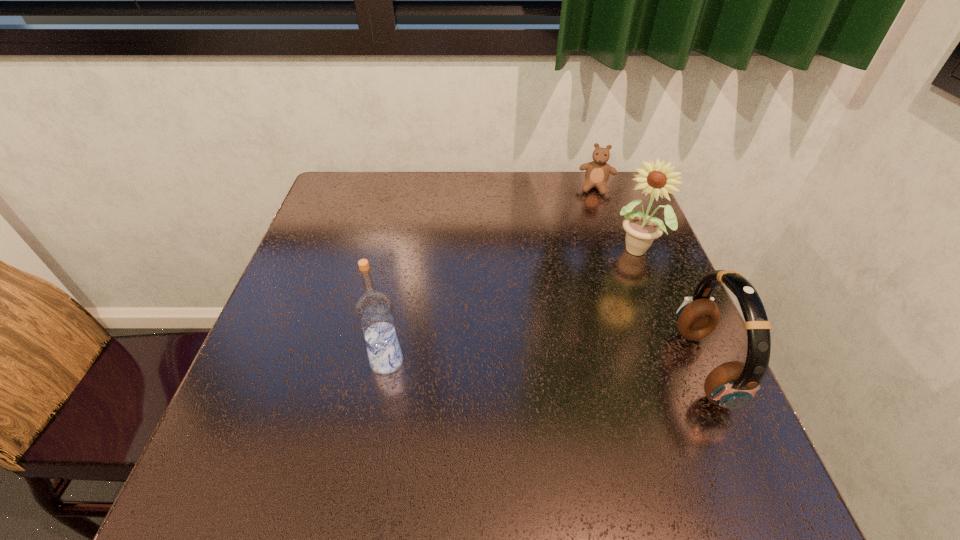
At what (x,y) coordinates should I click in order to perform the action: click on free location that satisfies the following two spatial constraints: 1. on the front side of the teddy bear; 2. on the right side of the sunflower. Please return your answer as a coordinate pair (x, y). This screenshot has height=540, width=960. Looking at the image, I should click on (618, 250).

Image resolution: width=960 pixels, height=540 pixels. Identify the location of free space that satisfies the following two spatial constraints: 1. on the front side of the second shortest object; 2. on the ear cup of the vodka. (x=386, y=367).